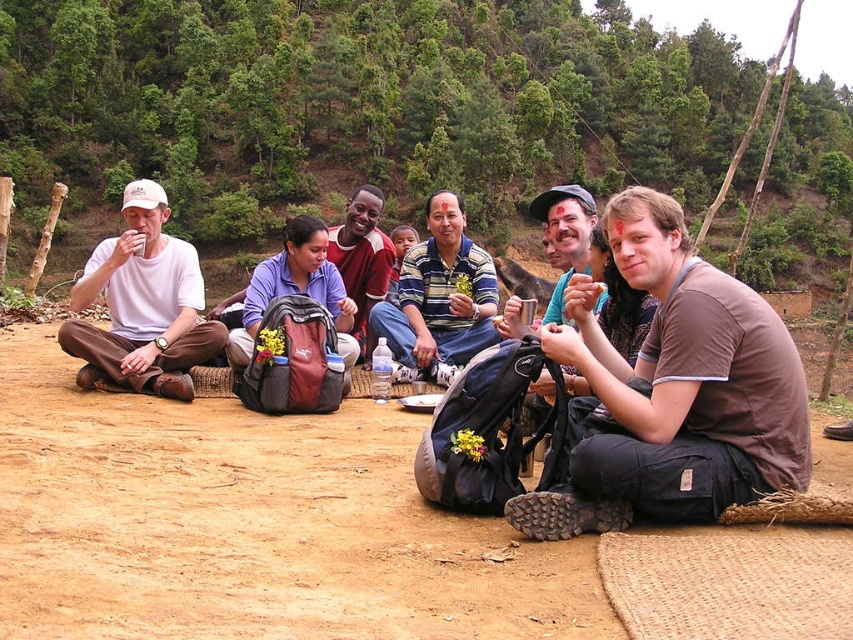
Question: Which point appears farthest from the camera in this image?

Choices:
 (A) pos(375,296)
 (B) pos(752,449)
 (C) pos(161,189)
 (D) pos(165,612)

Answer: (A)

Question: Which is farther from the blue fabric shirt at center?

Choices:
 (A) brown cotton shirt at center
 (B) matte white shirt at left
 (C) brown dirt field at lower center

Answer: (C)

Question: Does brown dirt field at lower center appear on the right side of blue fabric shirt at center?

Choices:
 (A) no
 (B) yes

Answer: (B)

Question: Can you confirm if brown dirt field at lower center is positioned above matte white shirt at left?

Choices:
 (A) no
 (B) yes

Answer: (A)

Question: Is brown cotton shirt at center positioned in front of matte white shirt at left?

Choices:
 (A) yes
 (B) no

Answer: (A)

Question: Which object appears farthest from the camera in this image?

Choices:
 (A) brown dirt field at lower center
 (B) blue fabric shirt at center

Answer: (B)